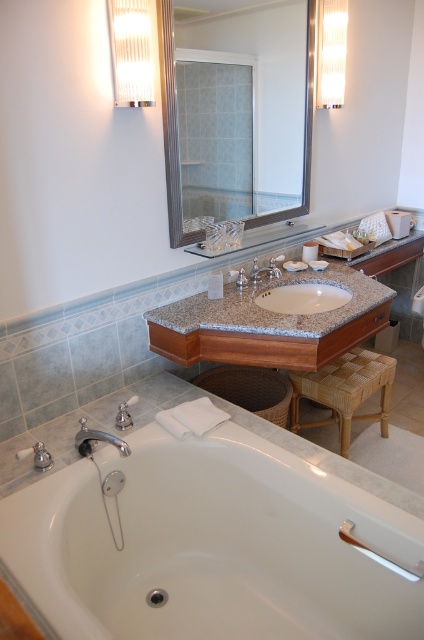
Consider the image. You are a drone operator trying to navigate a small drone through the bathroom. The drone must pass between the two points, point (343, 298) and point (253, 264). Based on the bathroom layout, which point should the drone approach first to ensure it stays closer to the viewer?

The drone should approach point (343, 298) first because it is closer to the viewer than point (253, 264).

You are standing in the bathroom and want to place a new plant pot between the white glossy bathtub at lower left and the woven rattan stool at lower right. Based on their positions, which side of the plant pot should face the bathtub?

The white glossy bathtub at lower left is to the left of the woven rattan stool at lower right, so the left side of the plant pot should face the bathtub.